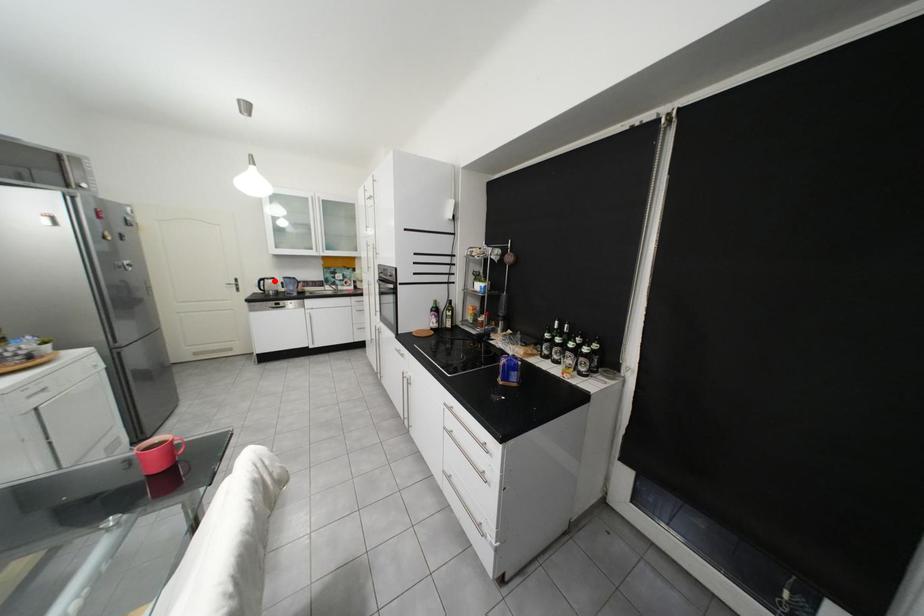
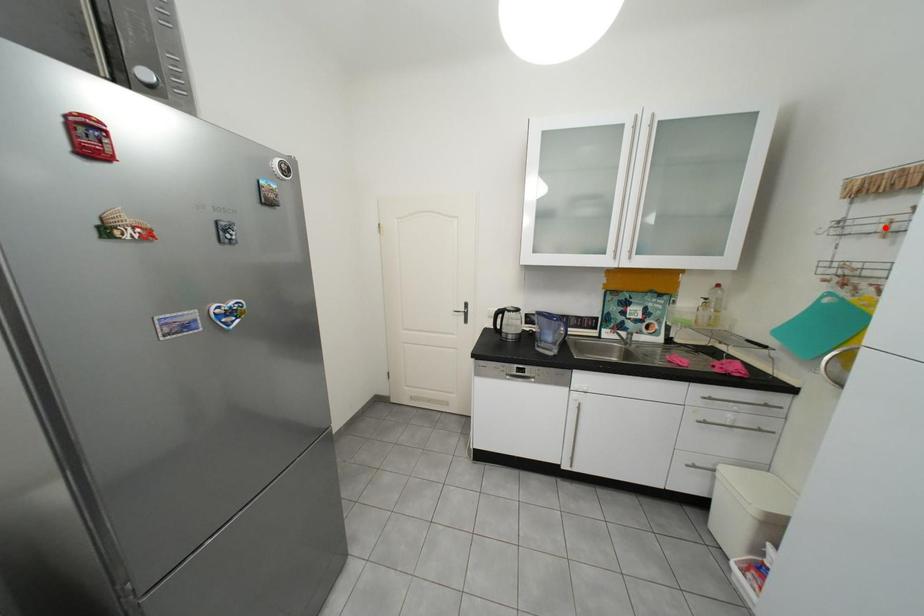
I am providing you with two images of the same scene from different viewpoints. A red point is marked on the first image and another point is marked on the second image. Is the red point in image1 aligned with the point shown in image2?

No